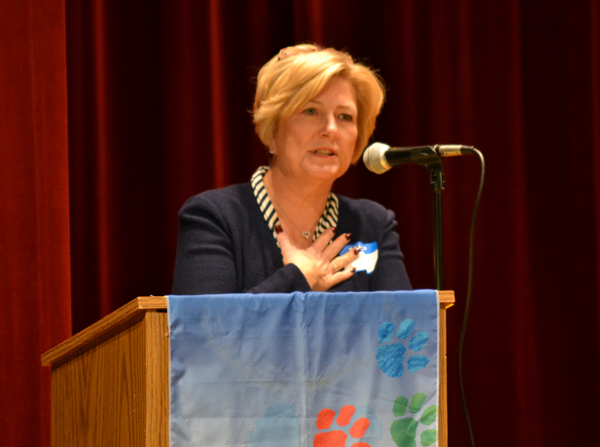
You are a GUI agent. You are given a task and a screenshot of the screen. Output one action in this format:
    pyautogui.click(x=<x>, y=<y>)
    Task: Click on the colorful banner
    
    Given the screenshot: What is the action you would take?
    pyautogui.click(x=312, y=364)